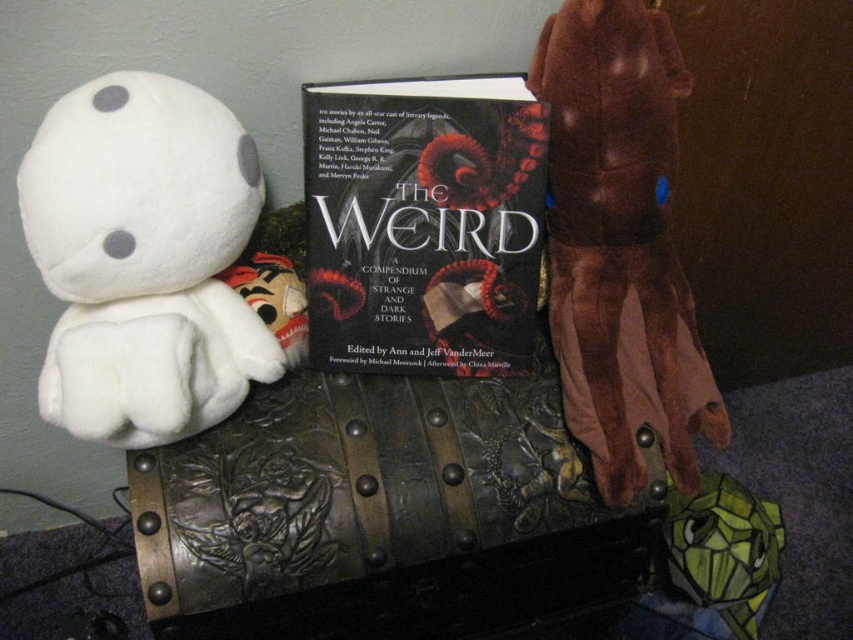
Image resolution: width=853 pixels, height=640 pixels. What are the coordinates of `dark matte book at center` in the screenshot? It's located at (422, 224).

Is dark matte book at center taller than brown plush toy at right?

No.

Is point (392, 333) positioned after point (610, 369)?

Yes, it is behind point (610, 369).

Find the location of a particular element. This screenshot has height=640, width=853. dark matte book at center is located at coordinates (422, 224).

Looking at this image, measure the distance from white plush toy at left to brown plush toy at right.

13.91 inches

Based on the photo, is white plush toy at left in front of brown plush toy at right?

That is True.

Is point (258, 209) farther from viewer compared to point (573, 163)?

Yes, it is behind point (573, 163).

The height and width of the screenshot is (640, 853). Find the location of `white plush toy at left`. white plush toy at left is located at coordinates (143, 259).

Is white plush toy at left thinner than dark matte book at center?

No, white plush toy at left is not thinner than dark matte book at center.

Which is more to the right, white plush toy at left or dark matte book at center?

dark matte book at center

What are the coordinates of `white plush toy at left` in the screenshot? It's located at (143, 259).